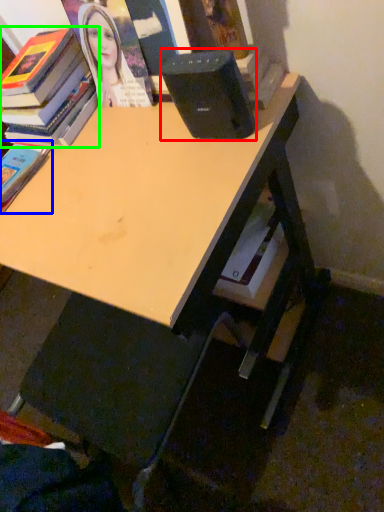
Question: Which object is the closest to the speaker (highlighted by a red box)? Choose among these: book (highlighted by a blue box) or book (highlighted by a green box).

Choices:
 (A) book
 (B) book

Answer: (B)